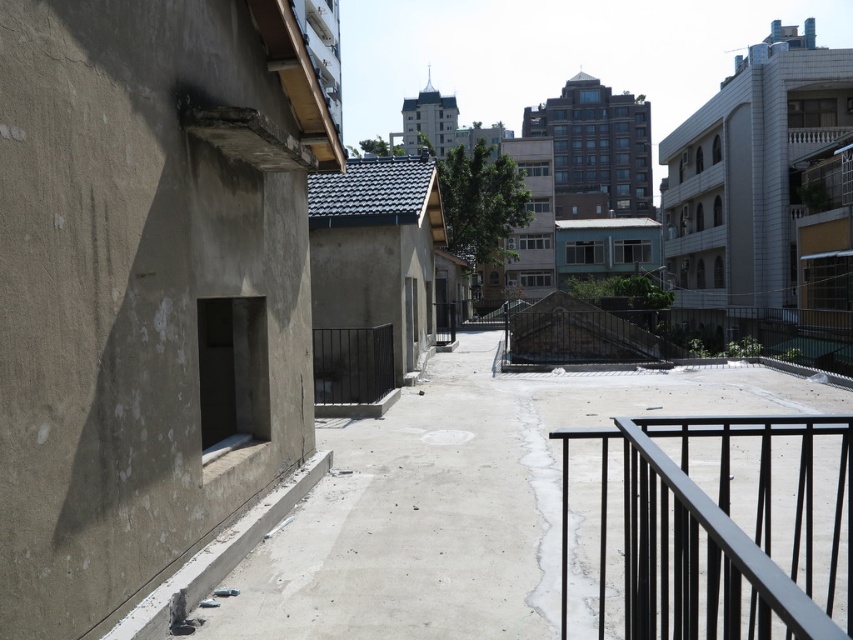
Does smooth concrete alley at center appear on the right side of black metal railing at right?

Correct, you'll find smooth concrete alley at center to the right of black metal railing at right.

Who is higher up, smooth concrete alley at center or black metal railing at right?

smooth concrete alley at center is higher up.

Who is more forward, (599, 376) or (624, 522)?

Point (624, 522) is in front.

At what (x,y) coordinates should I click in order to perform the action: click on smooth concrete alley at center. Please return your answer as a coordinate pair (x, y). The image size is (853, 640). Looking at the image, I should click on (460, 500).